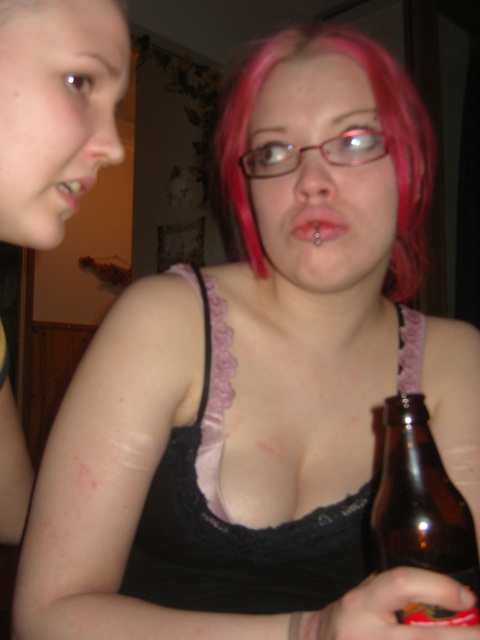
From the picture: Between brown glass bottle at lower right and matte pink lips at center, which one appears on the right side from the viewer's perspective?

From the viewer's perspective, brown glass bottle at lower right appears more on the right side.

The width and height of the screenshot is (480, 640). Identify the location of brown glass bottle at lower right. (421, 512).

Can you confirm if pink hair at center is wider than brown glass bottle at lower right?

Yes.

Does pink hair at center appear under brown glass bottle at lower right?

No, pink hair at center is not below brown glass bottle at lower right.

Between point (245, 182) and point (434, 481), which one is positioned behind?

The point (245, 182) is behind.

The height and width of the screenshot is (640, 480). In order to click on pink hair at center in this screenshot , I will do `click(383, 132)`.

Between pink hair at center and matte flesh-colored lips at center, which one has less height?

matte flesh-colored lips at center

Between pink hair at center and matte flesh-colored lips at center, which one is positioned higher?

pink hair at center

The height and width of the screenshot is (640, 480). Find the location of `pink hair at center`. pink hair at center is located at coordinates [x=383, y=132].

Where is `pink hair at center`? pink hair at center is located at coordinates (383, 132).